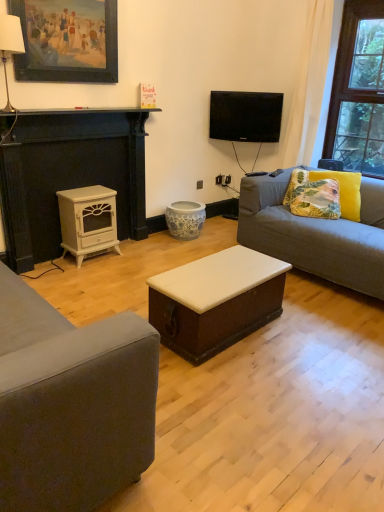
The height and width of the screenshot is (512, 384). What are the coordinates of `vacant region in front of gray fabric couch at right` in the screenshot? It's located at (322, 332).